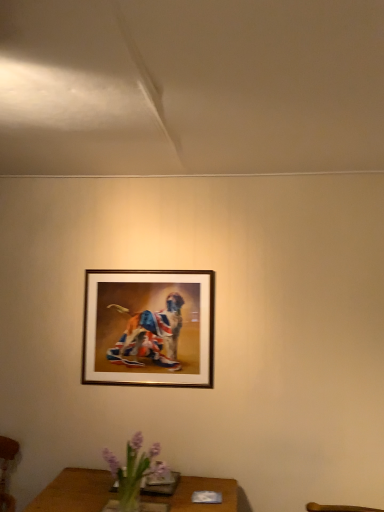
Locate an element on the screen. The height and width of the screenshot is (512, 384). gold metallic picture frame at center is located at coordinates (149, 328).

The height and width of the screenshot is (512, 384). What do you see at coordinates (149, 328) in the screenshot?
I see `gold metallic picture frame at center` at bounding box center [149, 328].

This screenshot has width=384, height=512. I want to click on gold metallic picture frame at center, so click(149, 328).